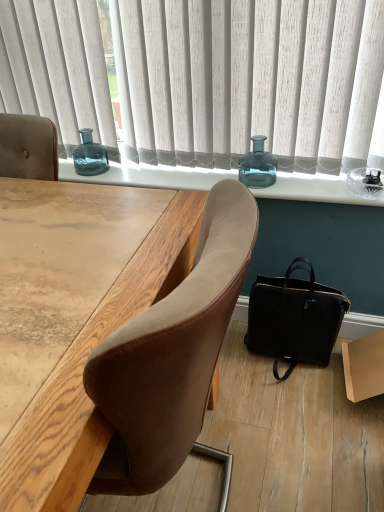
The height and width of the screenshot is (512, 384). I want to click on vacant space in white fabric curtain at upper center (from a real-world perspective), so click(278, 170).